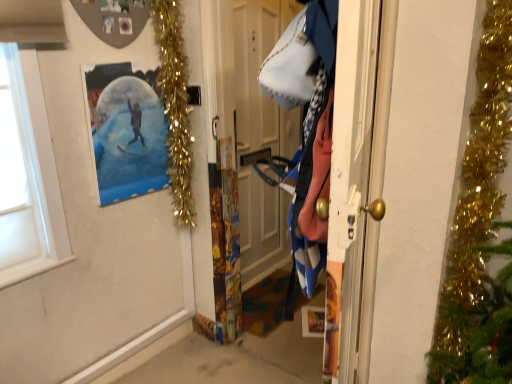
Question: Is polka dot paper snow globe at upper left in front of or behind blue denim jacket at right in the image?

Choices:
 (A) behind
 (B) front

Answer: (A)

Question: From a real-world perspective, is polka dot paper snow globe at upper left physically located above or below blue denim jacket at right?

Choices:
 (A) above
 (B) below

Answer: (B)

Question: Considering the real-world distances, which object is farthest from the wooden door at center?

Choices:
 (A) blue denim jacket at right
 (B) polka dot paper snow globe at upper left
 (C) gold tinsel garland at upper left

Answer: (A)

Question: Estimate the real-world distances between objects in this image. Which object is closer to the wooden door at center?

Choices:
 (A) gold tinsel garland at upper left
 (B) blue denim jacket at right
 (C) polka dot paper snow globe at upper left

Answer: (A)